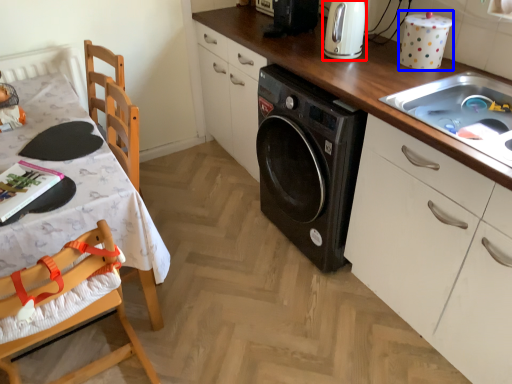
Question: Which object is further to the camera taking this photo, home appliance (highlighted by a red box) or appliance (highlighted by a blue box)?

Choices:
 (A) home appliance
 (B) appliance

Answer: (A)